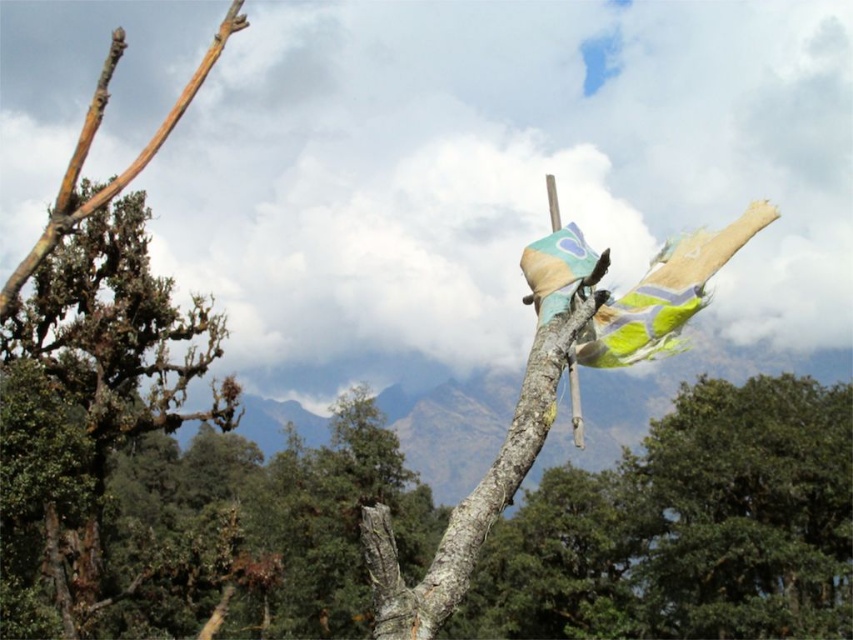
You are an artist planning to paint the scene. You need to decide which object to focus on first based on their sizes. Which object should you paint first, the green leafy tree at lower right or the brown rough bark at left?

The green leafy tree at lower right has a larger width than the brown rough bark at left, so you should paint the green leafy tree at lower right first to ensure its size is accurately represented before detailing smaller elements.

You are an explorer trying to navigate through the forest. You see a green leafy tree at lower right and a brown rough bark at left. Which object is closer to you as you face the scene?

The green leafy tree at lower right is closer to you because the brown rough bark at left is behind it.

You are a hiker who wants to reach the green leafy tree at lower right. The trail you are on is 50 meters long. Will you be able to reach the tree without leaving the trail?

The green leafy tree at lower right is 53.44 meters away from camera. Since the trail is only 50 meters long, you will not be able to reach the tree without leaving the trail.